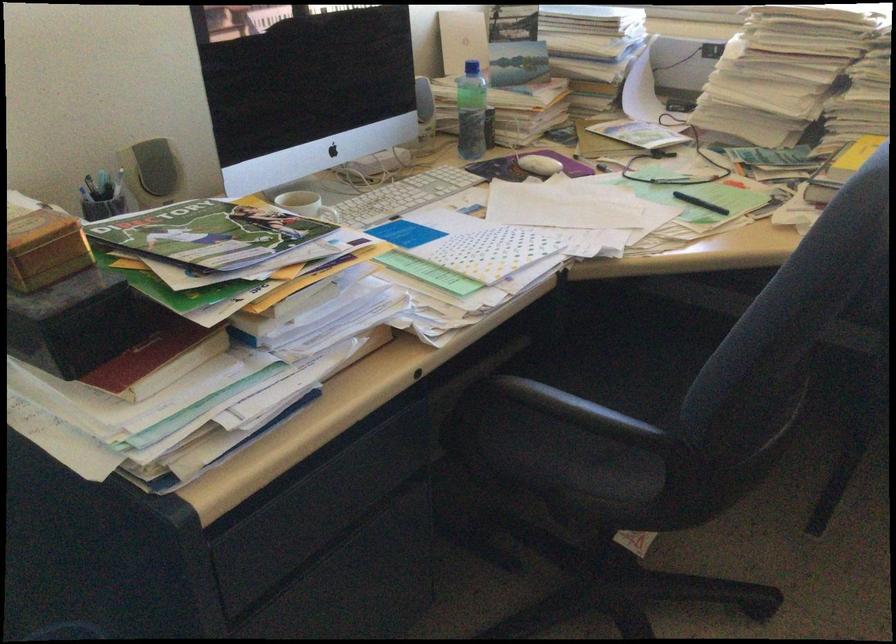
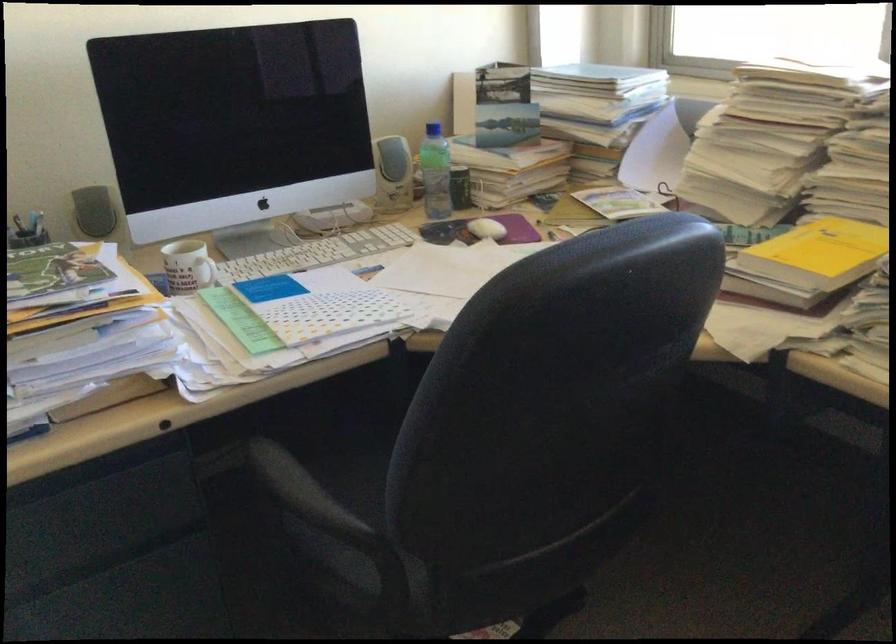
Where in the second image is the point corresponding to the point at 428,117 from the first image?

(392, 174)